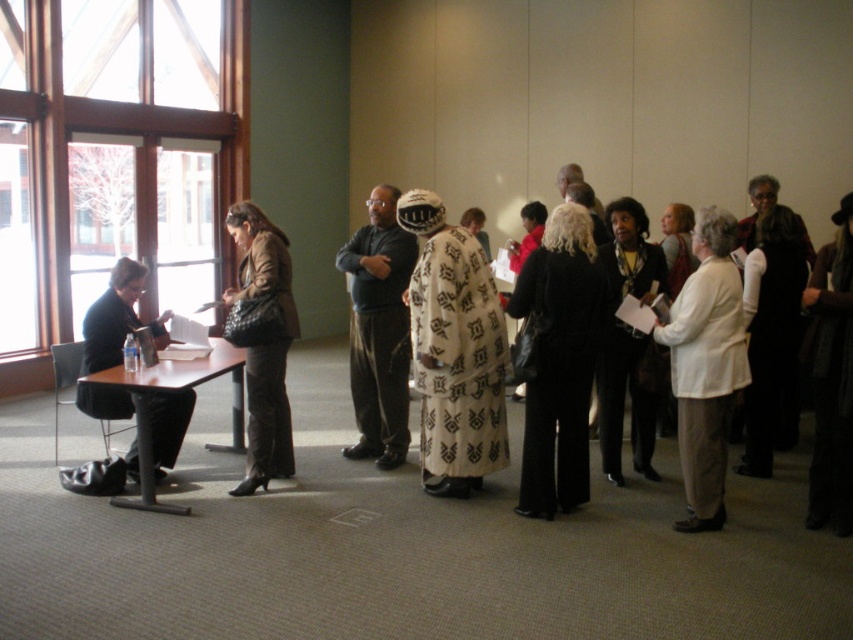
You are organizing a presentation and need to place a large poster on the wall behind the matte brown coat at center. The poster is as wide as the clear glass window at left. Will the poster fit without overlapping the coat?

The clear glass window at left is wider than the matte brown coat at center, so the poster, which matches the window width, will be wider than the coat. Therefore, placing the poster without overlapping the coat is possible as long as it is centered or positioned to the sides appropriately.

Imagine you are standing at the center of the room facing the large windows. Based on the coordinates provided, where would the point at (115, 154) be located relative to the clear glass window at left?

The point at (115, 154) corresponds to the clear glass window at left, so it is located at the left side of the room.

You are a delivery person carrying a large package that measures 3 meters in length. You need to navigate through the space between the clear glass window at left and the matte brown coat at center to reach the delivery area. Can you pass through this space without tilting the package?

The distance between the clear glass window at left and the matte brown coat at center is 3.20 meters. Since your package is 3 meters long, it should fit comfortably within the space, allowing you to pass through without tilting it.